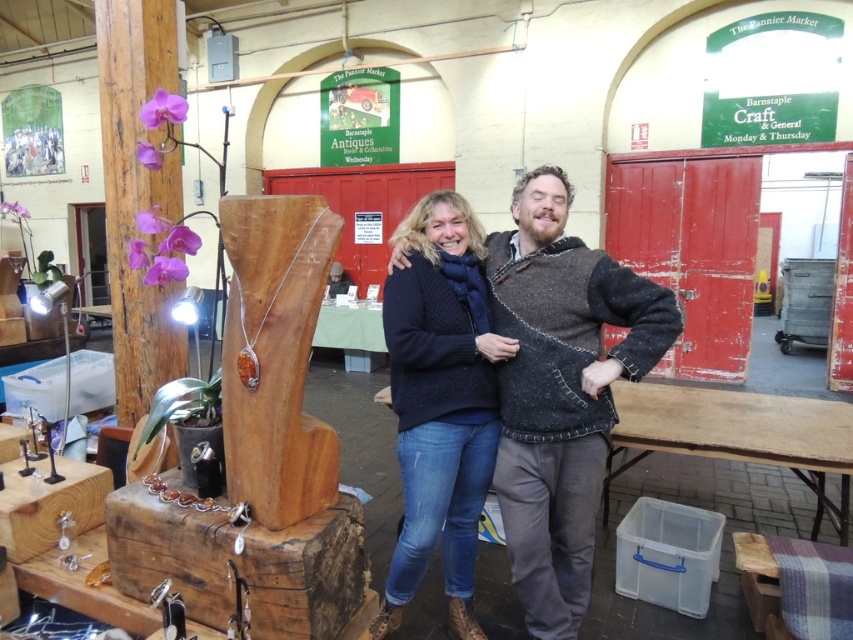
Question: Can you confirm if knitted dark blue sweater at center is positioned to the left of wooden post at left?

Choices:
 (A) no
 (B) yes

Answer: (A)

Question: Which point is closer to the camera?

Choices:
 (A) knitted sweater at center
 (B) wooden sculpture at left
 (C) knitted dark blue sweater at center

Answer: (B)

Question: Which point is farther from the camera taking this photo?

Choices:
 (A) (463, 458)
 (B) (549, 576)
 (C) (119, 28)

Answer: (C)

Question: Can you confirm if knitted sweater at center is positioned to the left of wooden post at left?

Choices:
 (A) no
 (B) yes

Answer: (A)

Question: Which is farther from the wooden post at left?

Choices:
 (A) knitted dark blue sweater at center
 (B) wooden sculpture at left

Answer: (A)

Question: Is wooden sculpture at left positioned before wooden post at left?

Choices:
 (A) yes
 (B) no

Answer: (A)